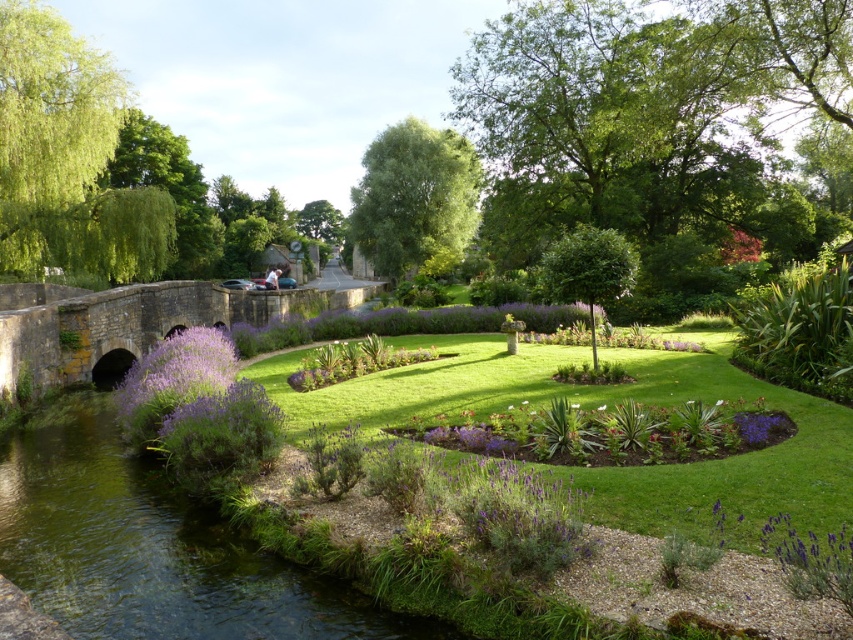
Question: Is green grassy stream at lower left above purple matte flower at lower right?

Choices:
 (A) yes
 (B) no

Answer: (B)

Question: Among these objects, which one is farthest from the camera?

Choices:
 (A) purple fluffy bush at left
 (B) stone bridge at left
 (C) purple matte flower at lower right
 (D) green grassy stream at lower left

Answer: (B)

Question: Can you confirm if stone bridge at left is positioned below purple matte flower at lower right?

Choices:
 (A) yes
 (B) no

Answer: (B)

Question: Observing the image, what is the correct spatial positioning of stone bridge at left in reference to purple matte flower at lower right?

Choices:
 (A) left
 (B) right

Answer: (A)

Question: Estimate the real-world distances between objects in this image. Which object is closer to the stone bridge at left?

Choices:
 (A) purple matte flower at lower right
 (B) green grassy stream at lower left
 (C) purple fluffy bush at left

Answer: (C)

Question: Which object is the farthest from the purple matte flower at lower right?

Choices:
 (A) green grassy stream at lower left
 (B) stone bridge at left

Answer: (B)